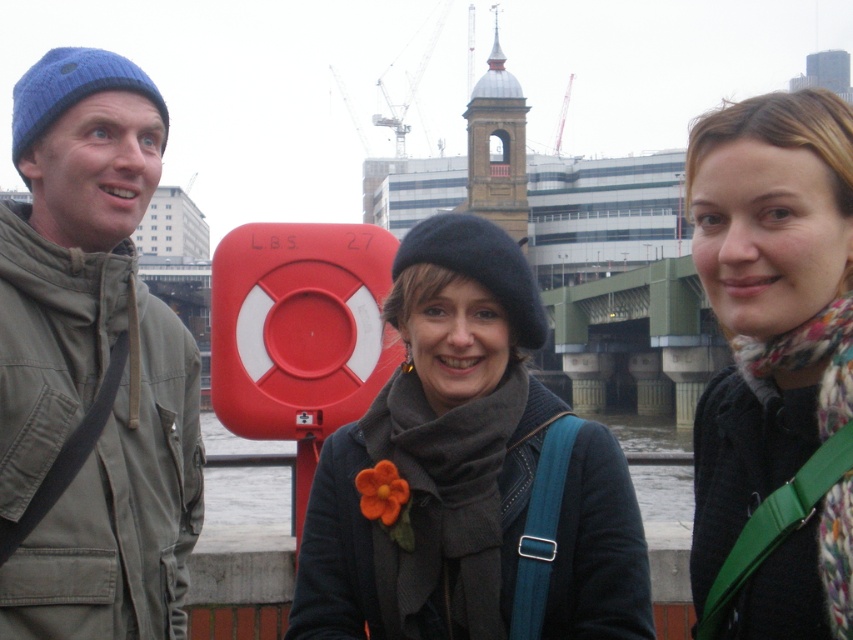
Can you confirm if dark gray wool scarf at center is taller than floral scarf at center?

No, dark gray wool scarf at center is not taller than floral scarf at center.

Who is positioned more to the right, dark gray wool scarf at center or floral scarf at center?

From the viewer's perspective, floral scarf at center appears more on the right side.

What do you see at coordinates (468, 474) in the screenshot? I see `dark gray wool scarf at center` at bounding box center [468, 474].

The height and width of the screenshot is (640, 853). I want to click on dark gray wool scarf at center, so click(x=468, y=474).

Is knitted blue beanie at left shorter than floral scarf at center?

Incorrect, knitted blue beanie at left's height does not fall short of floral scarf at center's.

Between knitted blue beanie at left and floral scarf at center, which one is positioned higher?

Positioned higher is floral scarf at center.

Image resolution: width=853 pixels, height=640 pixels. Describe the element at coordinates (91, 365) in the screenshot. I see `knitted blue beanie at left` at that location.

You are a GUI agent. You are given a task and a screenshot of the screen. Output one action in this format:
    pyautogui.click(x=<x>, y=<y>)
    Task: Click on the knitted blue beanie at left
    
    Given the screenshot: What is the action you would take?
    pyautogui.click(x=91, y=365)

Is point (401, 445) positioned behind point (30, 344)?

Yes.

Which is behind, point (317, 577) or point (48, 438)?

Positioned behind is point (317, 577).

This screenshot has height=640, width=853. Identify the location of dark gray wool scarf at center. (468, 474).